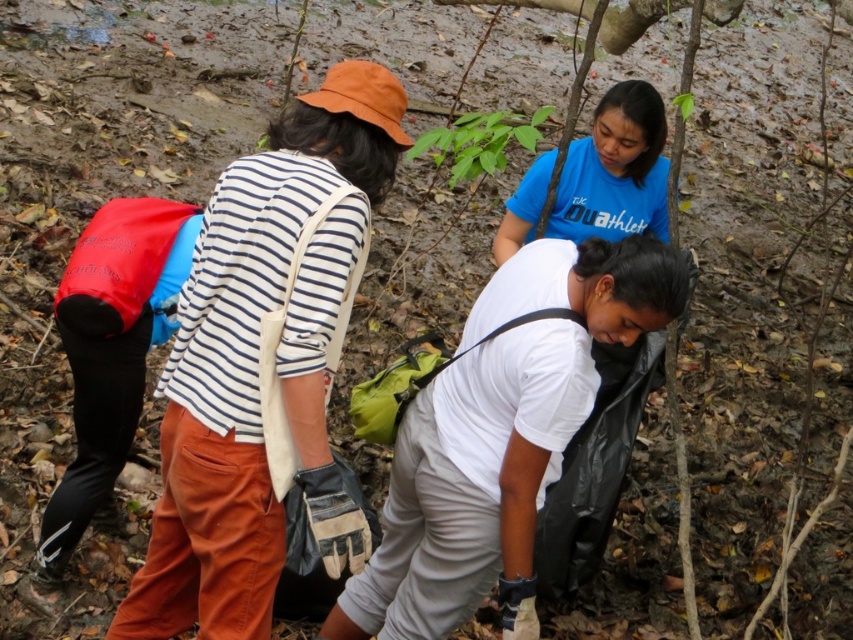
Looking at this image, you are part of a team organizing an outdoor event and need to identify the order of participants based on their clothing. Which participant is positioned closer to the front, the matte striped shirt at center or the blue matte shirt at center?

The matte striped shirt at center is positioned closer to the front compared to the blue matte shirt at center, as it is described as being in front of the latter.

You are a photographer trying to capture a group photo of the white matte shirt at center and the blue matte shirt at center. Based on their positions, which one should you focus on first to ensure they are both in frame?

The white matte shirt at center is positioned under the blue matte shirt at center, so focusing on the blue matte shirt at center first would ensure both are in frame as the white one is below it.

You are part of a hiking group and need to locate the leader who is wearing a matte striped shirt at center. From your current position, which direction should you move to find the leader if you are facing the white matte shirt at center?

The matte striped shirt at center is in front of the white matte shirt at center, so if you are facing the white matte shirt at center, the leader wearing the matte striped shirt at center would be directly in front of you.